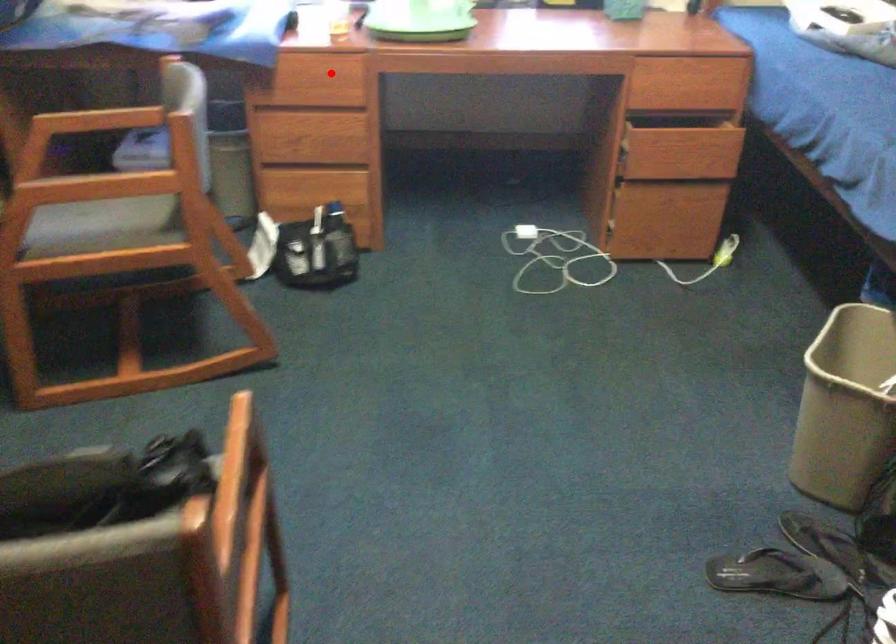
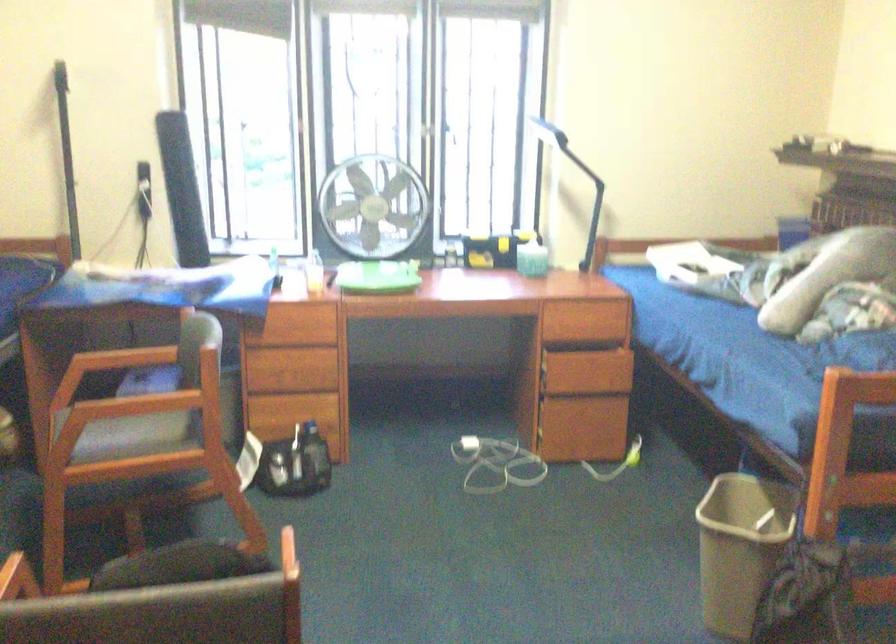
In the second image, find the point that corresponds to the highlighted location in the first image.

(306, 319)